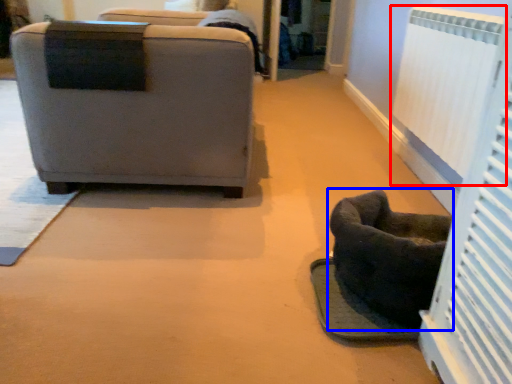
Question: Which point is closer to the camera, radiator (highlighted by a red box) or furniture (highlighted by a blue box)?

Choices:
 (A) radiator
 (B) furniture

Answer: (B)